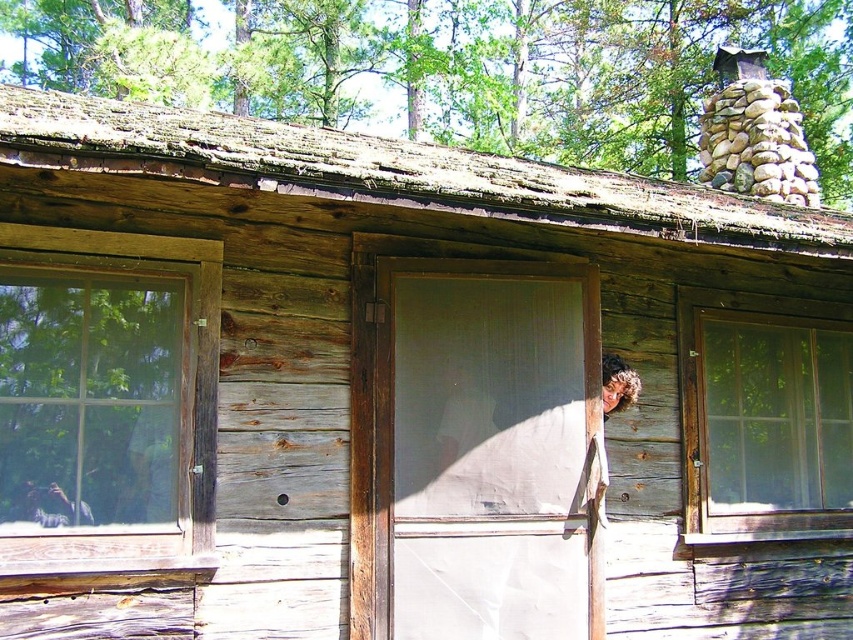
Where is the weathered wood roof at upper center located in the image?

The weathered wood roof at upper center is located at point (392, 172).